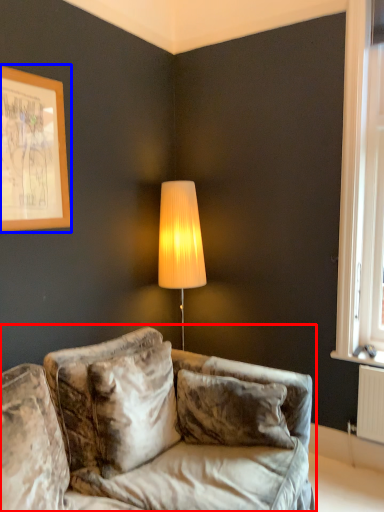
Question: Which point is closer to the camera, studio couch (highlighted by a red box) or picture frame (highlighted by a blue box)?

Choices:
 (A) studio couch
 (B) picture frame

Answer: (A)